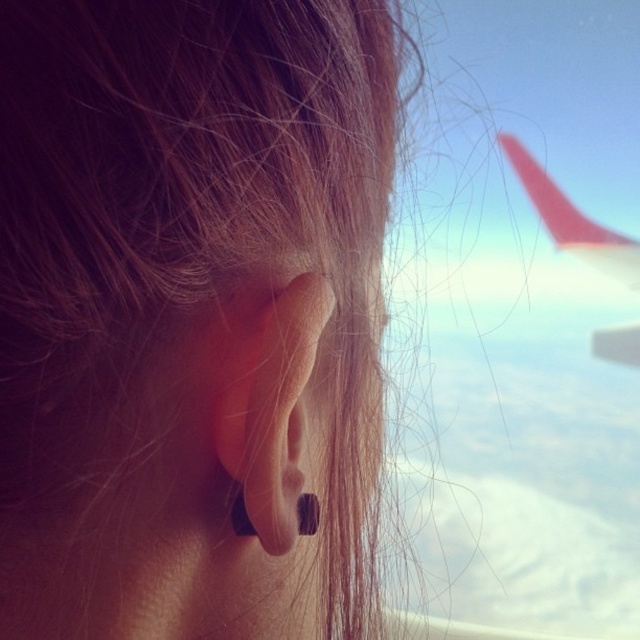
You are a passenger on an airplane and notice the transparent glass airplane wing at upper right and the black matte earring at ear. Which object is positioned higher in the scene?

The transparent glass airplane wing at upper right is above the black matte earring at ear, so it is positioned higher in the scene.